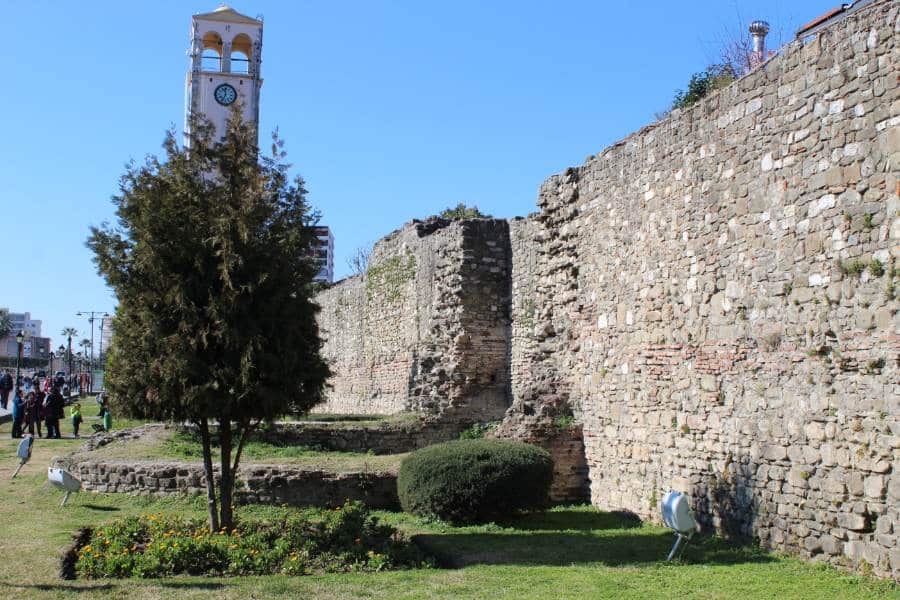
Image resolution: width=900 pixels, height=600 pixels. I want to click on wall, so click(x=644, y=321).